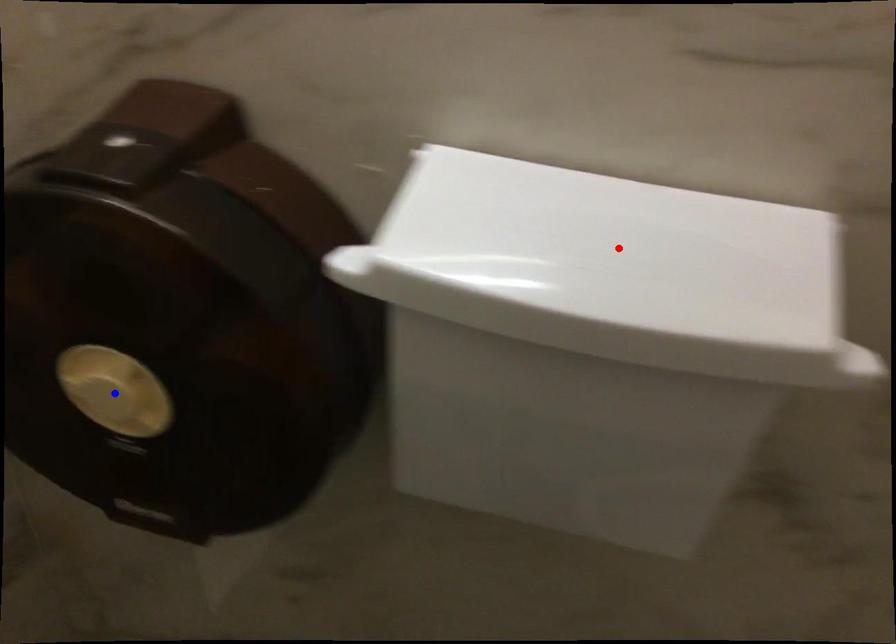
Question: Two points are marked on the image. Which point is closer to the camera?

Choices:
 (A) Blue point is closer.
 (B) Red point is closer.

Answer: (B)